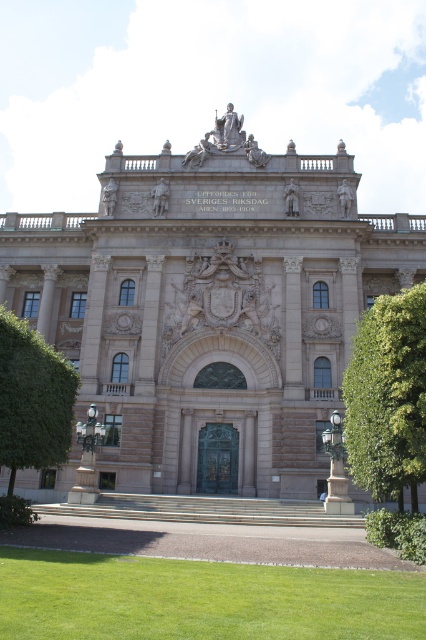
You are a visitor standing in front of the grand building. You notice a green leafy tree at left and a polished bronze lamp post at lower right. Which object appears bigger in the scene?

The green leafy tree at left appears bigger in the scene as it has a larger size compared to the polished bronze lamp post at lower right.

You are an architect analyzing the proportions of the beige stone palace at center and the green leafy tree at left in the image. Which structure appears larger in size?

The beige stone palace at center is bigger than the green leafy tree at left, so the palace appears larger in size.